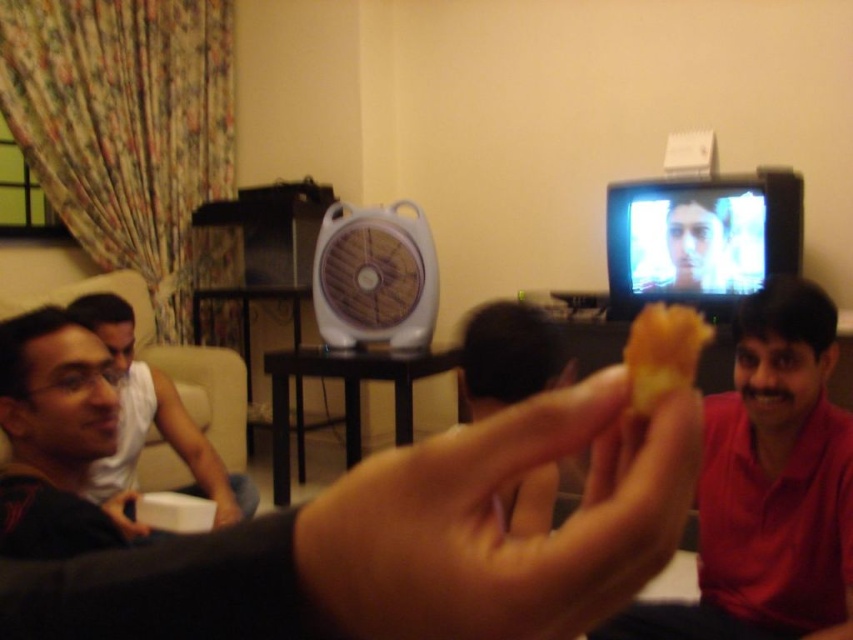
Is the position of skinny yellow bread at center less distant than that of matte white shirt at left?

That is True.

Who is positioned more to the right, skinny yellow bread at center or matte white shirt at left?

skinny yellow bread at center

Which is in front, point (502, 484) or point (221, 486)?

Positioned in front is point (502, 484).

I want to click on skinny yellow bread at center, so click(502, 522).

Which is more to the right, brown matte bread at center or brown leather hand at center?

From the viewer's perspective, brown matte bread at center appears more on the right side.

Between point (477, 381) and point (227, 509), which one is positioned behind?

The point (227, 509) is behind.

Does point (544, 506) come closer to viewer compared to point (229, 516)?

That is True.

At what (x,y) coordinates should I click in order to perform the action: click on brown matte bread at center. Please return your answer as a coordinate pair (x, y). This screenshot has width=853, height=640. Looking at the image, I should click on [x=508, y=356].

Is matte white shirt at left to the right of brown leather hand at center from the viewer's perspective?

In fact, matte white shirt at left is to the left of brown leather hand at center.

Who is more distant from viewer, (135,360) or (227,513)?

Point (135,360)

Who is more distant from viewer, [97,499] or [215,512]?

The point [215,512] is more distant.

Locate an element on the screen. matte white shirt at left is located at coordinates (151, 413).